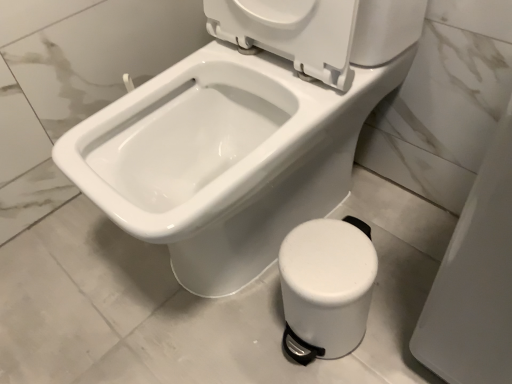
The image size is (512, 384). What are the coordinates of `blank space situated above white plastic pedal bin at lower right (from a real-world perspective)` in the screenshot? It's located at (323, 257).